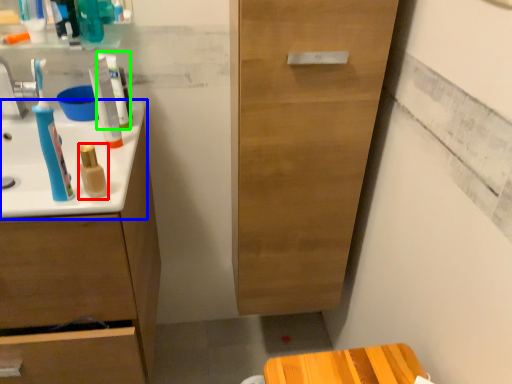
Question: Which is nearer to the mouthwash (highlighted by a red box)? sink (highlighted by a blue box) or toothpaste (highlighted by a green box).

Choices:
 (A) sink
 (B) toothpaste

Answer: (A)